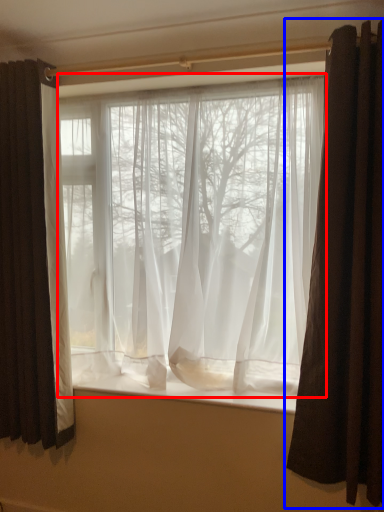
Question: Which point is further to the camera, curtain (highlighted by a red box) or curtain (highlighted by a blue box)?

Choices:
 (A) curtain
 (B) curtain

Answer: (A)